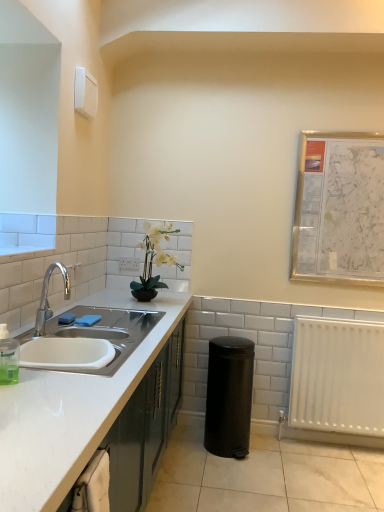
I want to click on free location to the right of black matte trash can at lower right, so click(280, 454).